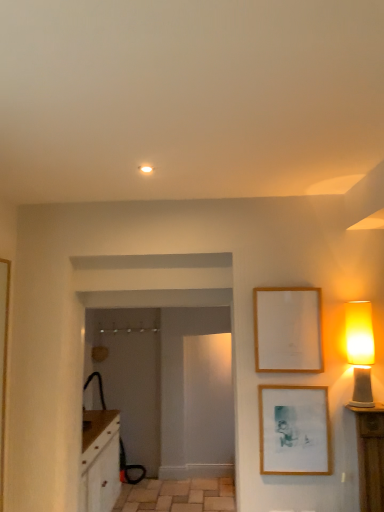
Question: Based on their positions, is matte wooden picture frame at lower right, positioned as the 1th picture frame in bottom-to-top order, located to the left or right of wooden picture frame at upper right, the first picture frame in the top-to-bottom sequence?

Choices:
 (A) right
 (B) left

Answer: (A)

Question: From a real-world perspective, is matte wooden picture frame at lower right, the second picture frame when ordered from top to bottom, physically located above or below wooden picture frame at upper right, which ranks as the second picture frame in bottom-to-top order?

Choices:
 (A) below
 (B) above

Answer: (A)

Question: Which is farther from the matte yellow glass lampshade at right?

Choices:
 (A) wooden picture frame at upper right, which ranks as the second picture frame in bottom-to-top order
 (B) matte wooden picture frame at lower right, positioned as the 1th picture frame in bottom-to-top order
 (C) natural stone tile at lower center

Answer: (C)

Question: Which is farther from the wooden picture frame at upper right, which ranks as the second picture frame in bottom-to-top order?

Choices:
 (A) matte wooden picture frame at lower right, positioned as the 1th picture frame in bottom-to-top order
 (B) matte yellow glass lampshade at right
 (C) natural stone tile at lower center

Answer: (C)